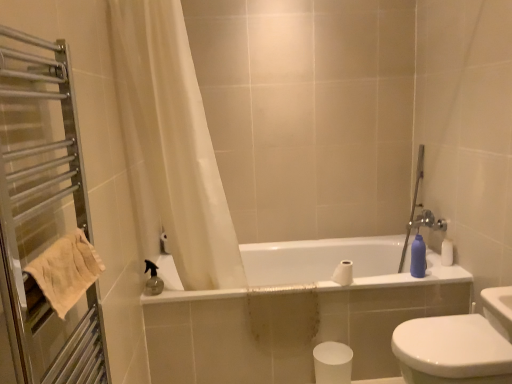
Question: Is white glossy bidet at lower right shorter than white matte toilet paper at center, marked as the second toilet paper in a bottom-to-top arrangement?

Choices:
 (A) yes
 (B) no

Answer: (B)

Question: Is white glossy bidet at lower right further to camera compared to white matte toilet paper at center, acting as the first toilet paper starting from the top?

Choices:
 (A) yes
 (B) no

Answer: (B)

Question: Is white glossy bidet at lower right not within white matte toilet paper at center, acting as the first toilet paper starting from the top?

Choices:
 (A) yes
 (B) no

Answer: (A)

Question: Can you confirm if white glossy bidet at lower right is taller than white matte toilet paper at center, acting as the first toilet paper starting from the top?

Choices:
 (A) yes
 (B) no

Answer: (A)

Question: Is white glossy bidet at lower right oriented away from white matte toilet paper at center, marked as the second toilet paper in a bottom-to-top arrangement?

Choices:
 (A) yes
 (B) no

Answer: (B)

Question: Is white matte toilet paper at center, acting as the first toilet paper starting from the top, wider or thinner than white glossy bidet at lower right?

Choices:
 (A) wide
 (B) thin

Answer: (B)

Question: Based on their sizes in the image, would you say white matte toilet paper at center, acting as the first toilet paper starting from the top, is bigger or smaller than white glossy bidet at lower right?

Choices:
 (A) small
 (B) big

Answer: (A)

Question: From a real-world perspective, is white matte toilet paper at center, marked as the second toilet paper in a bottom-to-top arrangement, positioned above or below white glossy bidet at lower right?

Choices:
 (A) below
 (B) above

Answer: (B)

Question: In the image, is white matte toilet paper at center, marked as the second toilet paper in a bottom-to-top arrangement, on the left side or the right side of white glossy bidet at lower right?

Choices:
 (A) left
 (B) right

Answer: (A)

Question: From a real-world perspective, is metal towel rack at left positioned above or below matte plastic bottle at right?

Choices:
 (A) above
 (B) below

Answer: (A)

Question: From the image's perspective, is metal towel rack at left located above or below matte plastic bottle at right?

Choices:
 (A) below
 (B) above

Answer: (B)

Question: Looking at their shapes, would you say metal towel rack at left is wider or thinner than matte plastic bottle at right?

Choices:
 (A) thin
 (B) wide

Answer: (B)

Question: In terms of height, does metal towel rack at left look taller or shorter compared to matte plastic bottle at right?

Choices:
 (A) tall
 (B) short

Answer: (A)

Question: Considering their positions, is white glossy bidet at lower right located in front of or behind white sheer curtain at upper left?

Choices:
 (A) front
 (B) behind

Answer: (A)

Question: Does point (456, 342) appear closer or farther from the camera than point (216, 249)?

Choices:
 (A) closer
 (B) farther

Answer: (A)